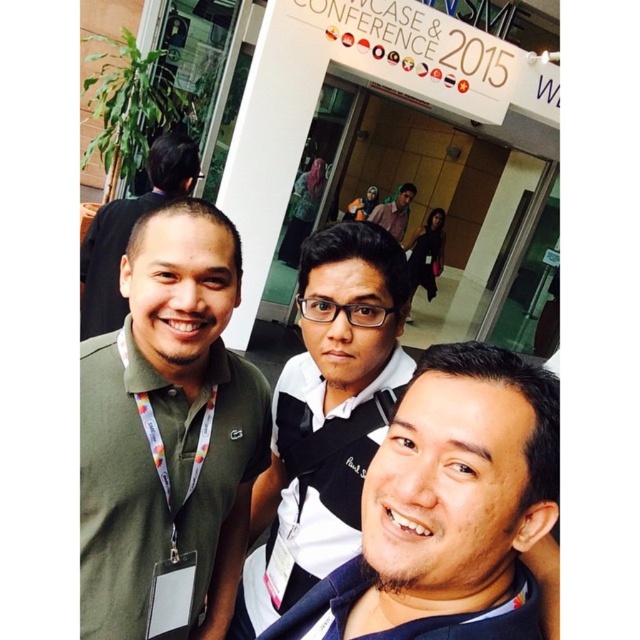
Question: Which object is farther from the camera taking this photo?

Choices:
 (A) green matte shirt at left
 (B) black matte shirt at center

Answer: (A)

Question: Is dark blue fabric shirt at center bigger than black matte shirt at center?

Choices:
 (A) no
 (B) yes

Answer: (A)

Question: Among these objects, which one is farthest from the camera?

Choices:
 (A) green matte shirt at left
 (B) green fabric shirt at left

Answer: (A)

Question: Can you confirm if green fabric shirt at left is positioned above green matte shirt at left?

Choices:
 (A) no
 (B) yes

Answer: (A)

Question: Which of the following is the closest to the observer?

Choices:
 (A) green fabric shirt at left
 (B) green matte shirt at left
 (C) dark blue fabric shirt at center

Answer: (C)

Question: Does dark blue fabric shirt at center have a larger size compared to dark brown leather jacket at upper center?

Choices:
 (A) no
 (B) yes

Answer: (A)